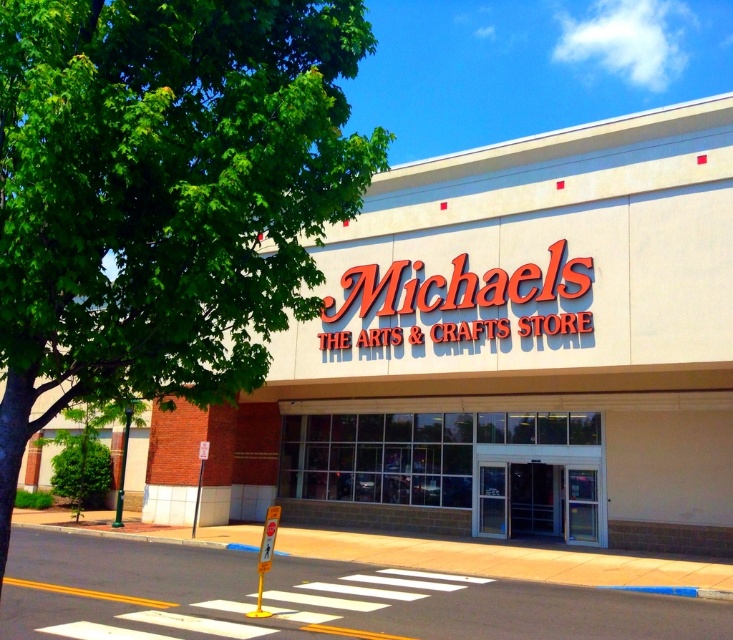
Question: Is green leafy tree at upper left bigger than clear glass doors at center?

Choices:
 (A) no
 (B) yes

Answer: (A)

Question: Can you confirm if white smooth building at center is wider than clear glass doors at center?

Choices:
 (A) yes
 (B) no

Answer: (A)

Question: Which point is closer to the camera?

Choices:
 (A) (331, 518)
 (B) (604, 189)
 (C) (48, 150)

Answer: (C)

Question: Considering the real-world distances, which object is farthest from the green leafy tree at upper left?

Choices:
 (A) white smooth building at center
 (B) clear glass doors at center

Answer: (B)

Question: Based on their relative distances, which object is nearer to the white smooth building at center?

Choices:
 (A) green leafy tree at upper left
 (B) clear glass doors at center

Answer: (B)

Question: Considering the relative positions of white smooth building at center and clear glass doors at center in the image provided, where is white smooth building at center located with respect to clear glass doors at center?

Choices:
 (A) right
 (B) left

Answer: (B)